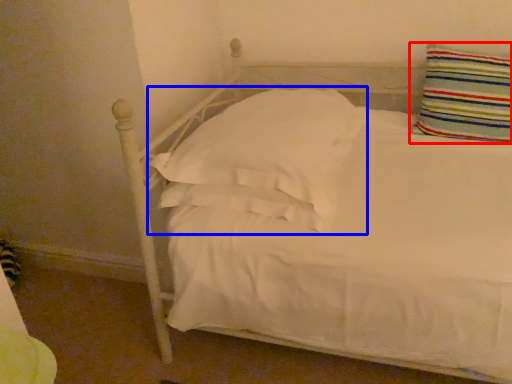
Question: Among these objects, which one is nearest to the camera, pillow (highlighted by a red box) or pillow (highlighted by a blue box)?

Choices:
 (A) pillow
 (B) pillow

Answer: (B)